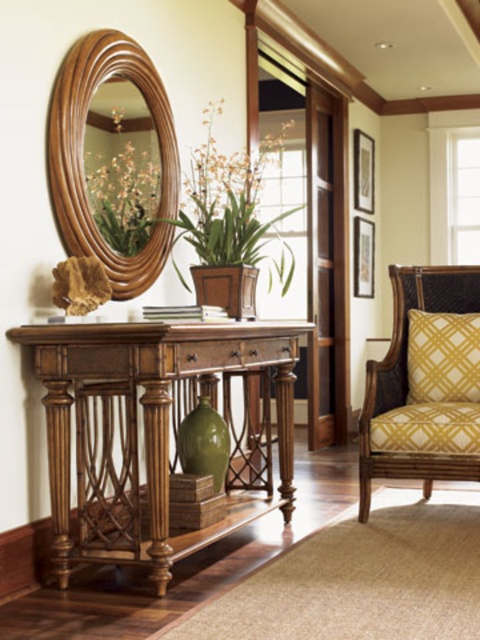
You are standing in the hallway and see the mahogany wood console table at center and the yellow woven cushion at right. Which object is positioned to the left of the other?

The mahogany wood console table at center is to the left of yellow woven cushion at right.